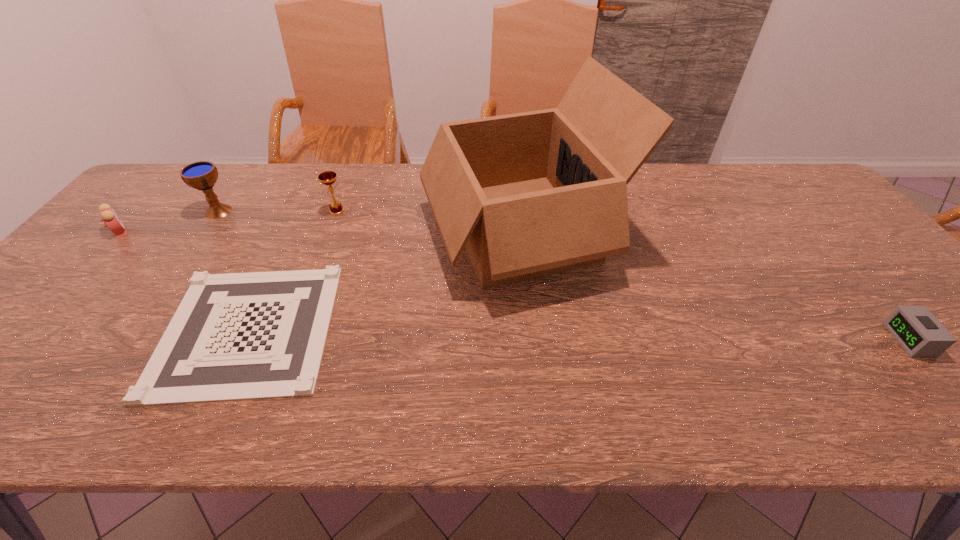
This screenshot has height=540, width=960. Identify the location of object identified as the closest to the shorter chalice. (236, 336).

The height and width of the screenshot is (540, 960). Find the location of `free location that satisfies the following two spatial constraints: 1. on the face of the shortest object; 2. on the left side of the left alarm clock`. free location that satisfies the following two spatial constraints: 1. on the face of the shortest object; 2. on the left side of the left alarm clock is located at coordinates (33, 329).

Identify the location of vacant space that satisfies the following two spatial constraints: 1. on the back side of the shortest object; 2. on the face of the farther alarm clock. (294, 232).

This screenshot has height=540, width=960. Find the location of `free spot that satisfies the following two spatial constraints: 1. on the front side of the shorter chalice; 2. on the face of the fourth tallest object`. free spot that satisfies the following two spatial constraints: 1. on the front side of the shorter chalice; 2. on the face of the fourth tallest object is located at coordinates (329, 232).